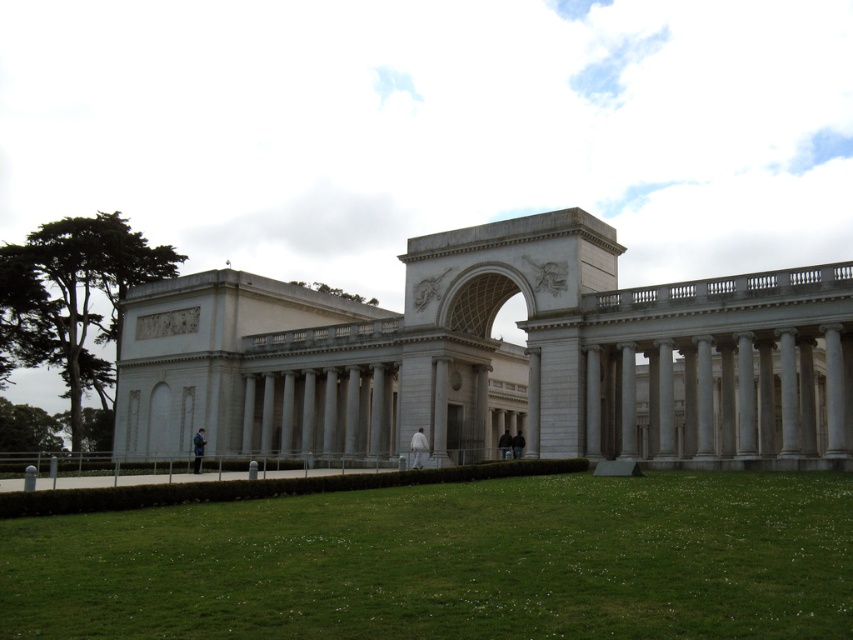
Question: Which of the following is the farthest from the observer?

Choices:
 (A) white stone palace at center
 (B) green grass at lower center

Answer: (A)

Question: Which point is closer to the camera?

Choices:
 (A) (454, 504)
 (B) (432, 358)

Answer: (A)

Question: Considering the relative positions of white stone palace at center and green grass at lower center in the image provided, where is white stone palace at center located with respect to green grass at lower center?

Choices:
 (A) below
 (B) above

Answer: (B)

Question: Does white stone palace at center have a smaller size compared to green grass at lower center?

Choices:
 (A) no
 (B) yes

Answer: (A)

Question: Does white stone palace at center appear on the right side of green grass at lower center?

Choices:
 (A) no
 (B) yes

Answer: (A)